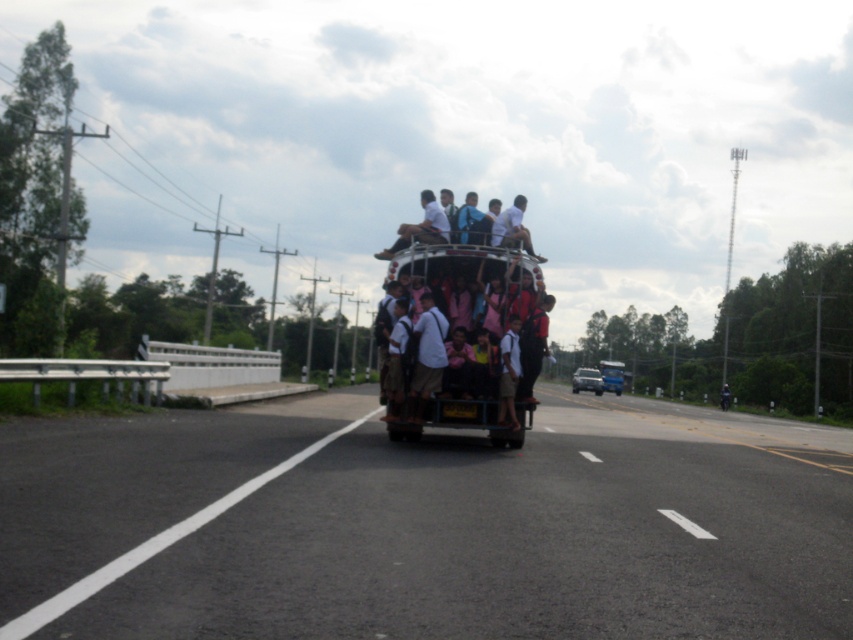
Which is below, blue metallic truck at center or metallic silver truck at center?

metallic silver truck at center

Does point (608, 376) come farther from viewer compared to point (595, 374)?

Yes, it is.

Does point (611, 371) come in front of point (579, 385)?

No, it is not.

This screenshot has width=853, height=640. In order to click on blue metallic truck at center in this screenshot , I will do `click(611, 376)`.

Which is behind, point (344, 588) or point (596, 374)?

The point (596, 374) is behind.

Is point (726, 577) less distant than point (598, 378)?

Yes.

I want to click on black asphalt road at center, so click(426, 524).

Can you confirm if black asphalt road at center is positioned above blue metallic truck at center?

Correct, black asphalt road at center is located above blue metallic truck at center.

Consider the image. Is black asphalt road at center in front of blue metallic truck at center?

Yes, it is.

Between point (614, 520) and point (618, 381), which one is positioned in front?

Point (614, 520)

Where is `black asphalt road at center`? This screenshot has width=853, height=640. black asphalt road at center is located at coordinates (426, 524).